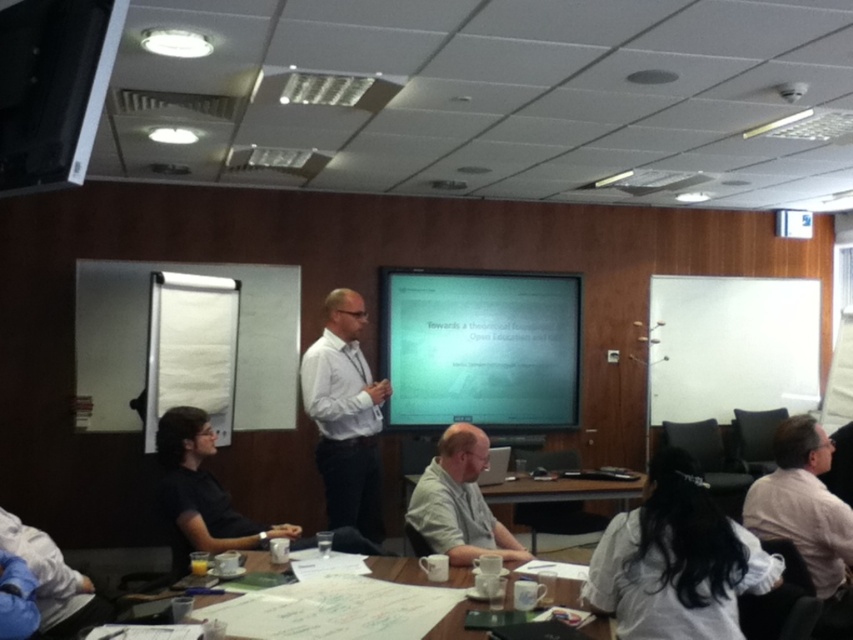
You are an attendee at the conference. You need to present a document to the presenter. The document is too large to hand over directly. You decide to project it onto the matte white projector screen at center. Considering the size of the white shirt at right, will the document be visible to everyone in the room?

The matte white projector screen at center is larger in size than the white shirt at right, so projecting the document onto the matte white projector screen at center will ensure visibility for everyone in the room.

You are attending a presentation in this conference room and need to hand a document to the person wearing the light beige shirt at center. Since you are standing behind the wooden table at center, which direction should you move to reach them?

The light beige shirt at center is positioned on the left side of the wooden table at center, so you should move to the left to reach them.